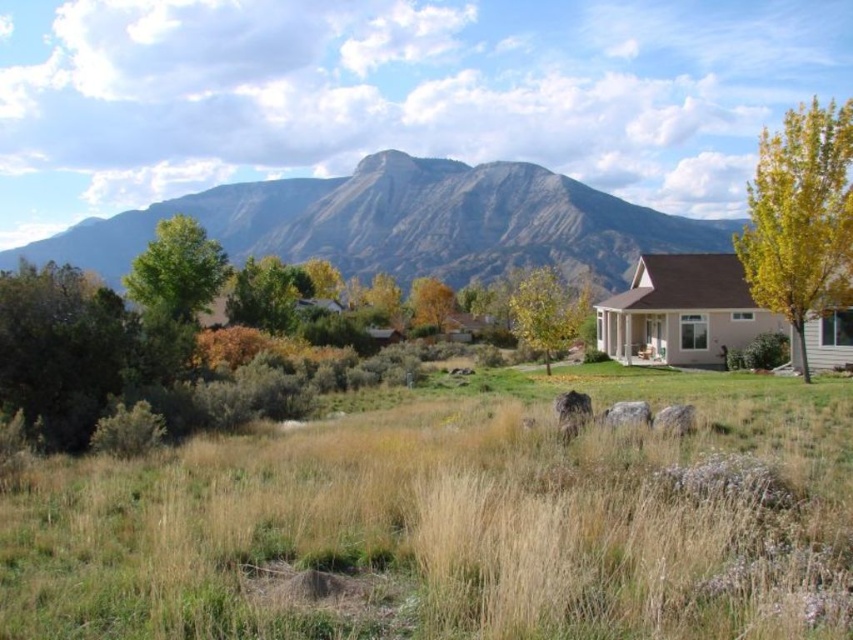
You are a hiker planning to take a photo of the rugged brown mountain at upper center and the green leafy tree at center from a position where both are visible. Considering their heights, which object will appear larger in the photo?

The rugged brown mountain at upper center will appear larger in the photo because it has a greater height compared to the green leafy tree at center.

You are standing in the grassy field and see both the green leafy tree at center and the yellow leafy tree at center. Which tree would block your view of the mountain in the background?

The green leafy tree at center is in front of the yellow leafy tree at center, so it would block your view of the mountain first.

You are standing in the middle of the grassy field and see both the green leafy tree at center and the yellow leafy tree at center. Which tree is positioned higher in the image?

The green leafy tree at center is located above the yellow leafy tree at center, so it is positioned higher in the image.